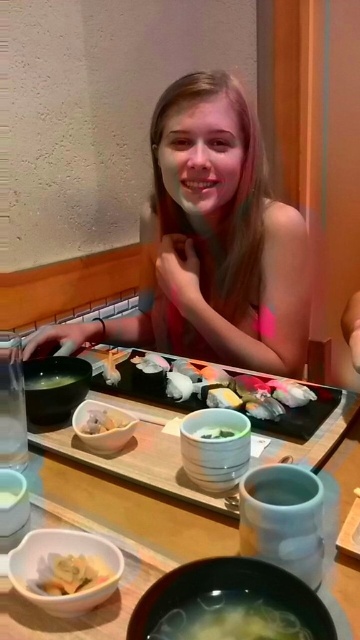
You are standing in front of the wooden table at center in a Japanese restaurant. If you want to place a 16 inch long sushi platter on the table, will it fit without overhanging the edges?

The wooden table at center is 18.62 inches away from the viewer. This distance does not provide information about the table dimensions. Therefore, it is impossible to determine if the 16 inch platter will fit without knowing the table size.

You are a waiter in a Japanese restaurant. You need to place a new order of miso soup on the table. The white glossy bowl at center is already on the wooden table at center. Where should you place the new bowl to avoid blocking the existing one?

The wooden table at center is in front of the white glossy bowl at center, so you should place the new bowl behind the existing white glossy bowl at center to avoid blocking it.

What is the exact location of the pink matte bikini top at center in the image?

The pink matte bikini top at center is located at point [212,243].